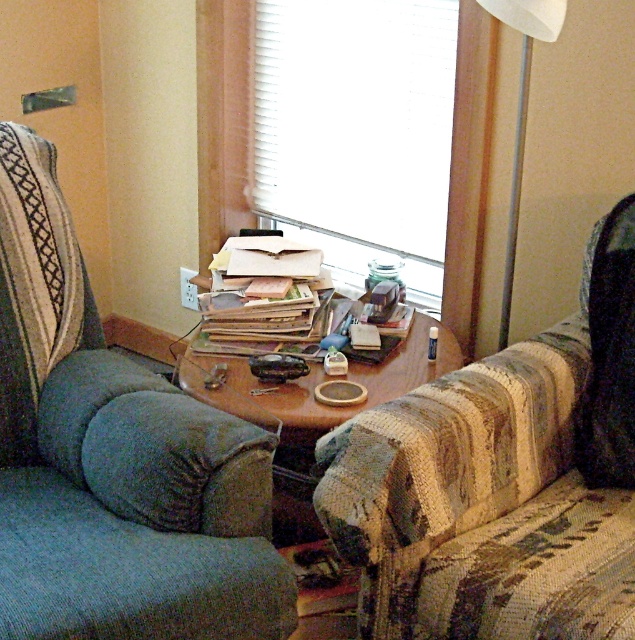
Who is shorter, blue fabric swivel chair at left or white matte window at center?

With less height is white matte window at center.

Is blue fabric swivel chair at left below white matte window at center?

Indeed, blue fabric swivel chair at left is positioned under white matte window at center.

Who is more forward, (x=102, y=410) or (x=337, y=1)?

Point (x=102, y=410)

I want to click on blue fabric swivel chair at left, so click(114, 460).

Can you confirm if striped fabric couch at center is smaller than white matte window at center?

No.

Does striped fabric couch at center have a lesser height compared to white matte window at center?

Yes.

Does point (582, 429) come behind point (375, 109)?

No.

Image resolution: width=635 pixels, height=640 pixels. In order to click on striped fabric couch at center in this screenshot , I will do `click(502, 481)`.

Is velvety black pillow at right thinner than matte black car at center?

In fact, velvety black pillow at right might be wider than matte black car at center.

Is velvety black pillow at right smaller than matte black car at center?

No.

Does point (598, 378) come closer to viewer compared to point (283, 355)?

That is True.

At what (x,y) coordinates should I click in order to perform the action: click on velvety black pillow at right. Please return your answer as a coordinate pair (x, y). The image size is (635, 640). Looking at the image, I should click on (608, 355).